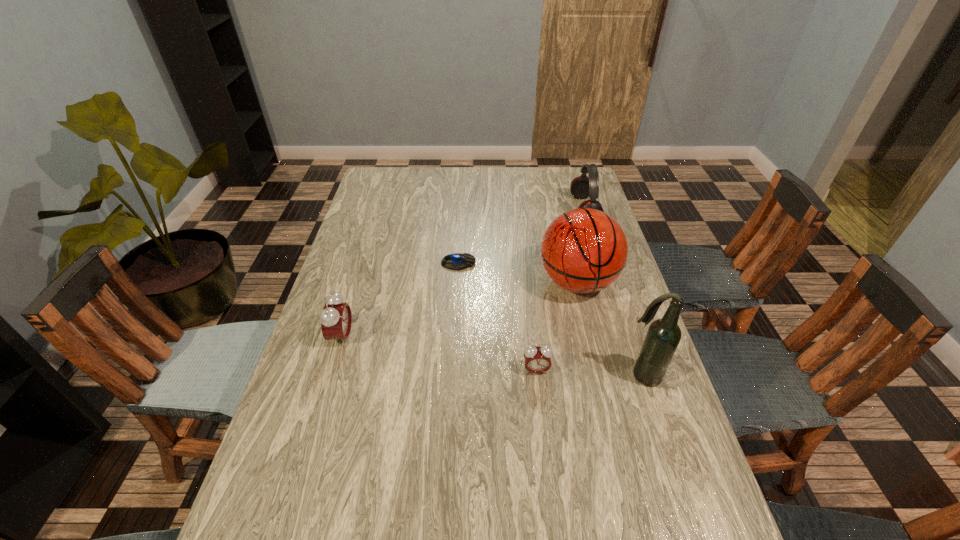
This screenshot has width=960, height=540. In order to click on the fourth farthest object in this screenshot , I will do `click(336, 318)`.

In order to click on the farther alarm clock in this screenshot , I will do pyautogui.click(x=336, y=318).

Locate an element on the screen. The width and height of the screenshot is (960, 540). the fifth tallest object is located at coordinates (x=537, y=359).

This screenshot has width=960, height=540. Identify the location of the right alarm clock. (537, 359).

I want to click on computer mouse, so click(457, 261).

Where is `the second object from left to right`? the second object from left to right is located at coordinates (457, 261).

Image resolution: width=960 pixels, height=540 pixels. Find the location of `earphone`. earphone is located at coordinates (581, 187).

Where is `the farthest object`? The height and width of the screenshot is (540, 960). the farthest object is located at coordinates (581, 187).

Locate an element on the screen. basketball is located at coordinates (584, 250).

Image resolution: width=960 pixels, height=540 pixels. I want to click on beer bottle, so click(x=663, y=336).